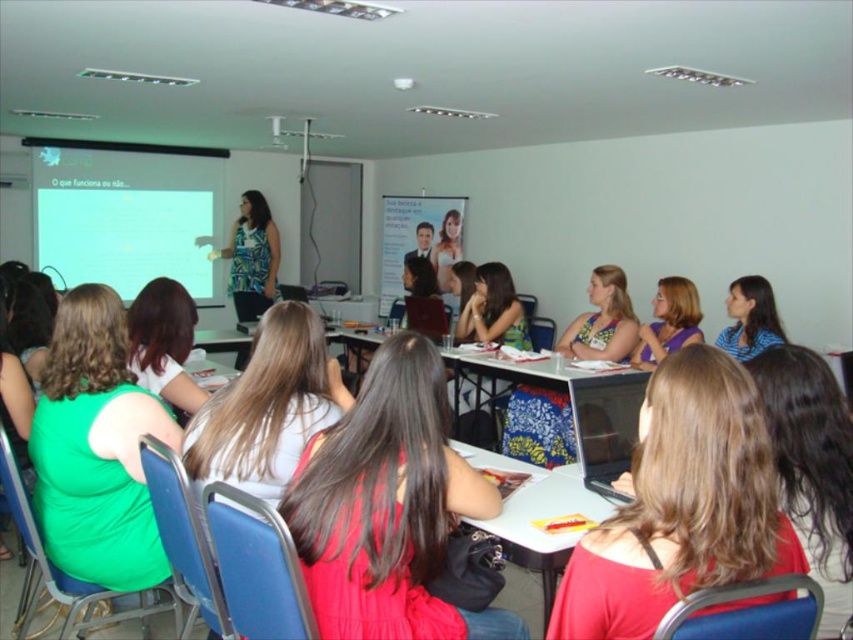
Question: Can you confirm if matte green dress at center is thinner than matte white blouse at center?

Choices:
 (A) no
 (B) yes

Answer: (A)

Question: Can you confirm if green matte dress at left is wider than floral fabric skirt at center?

Choices:
 (A) no
 (B) yes

Answer: (A)

Question: Which point is farther from the camera taking this photo?

Choices:
 (A) (344, 448)
 (B) (282, 413)

Answer: (B)

Question: Does matte red dress at center appear over purple satin dress at center?

Choices:
 (A) yes
 (B) no

Answer: (B)

Question: Which object is positioned closest to the smooth red hair at center?

Choices:
 (A) matte white blouse at center
 (B) green fabric dress at lower left
 (C) purple satin dress at center

Answer: (B)

Question: Among these points, which one is nearest to the camera?

Choices:
 (A) (553, 394)
 (B) (686, 307)
 (C) (235, 230)
 (D) (148, 330)

Answer: (D)